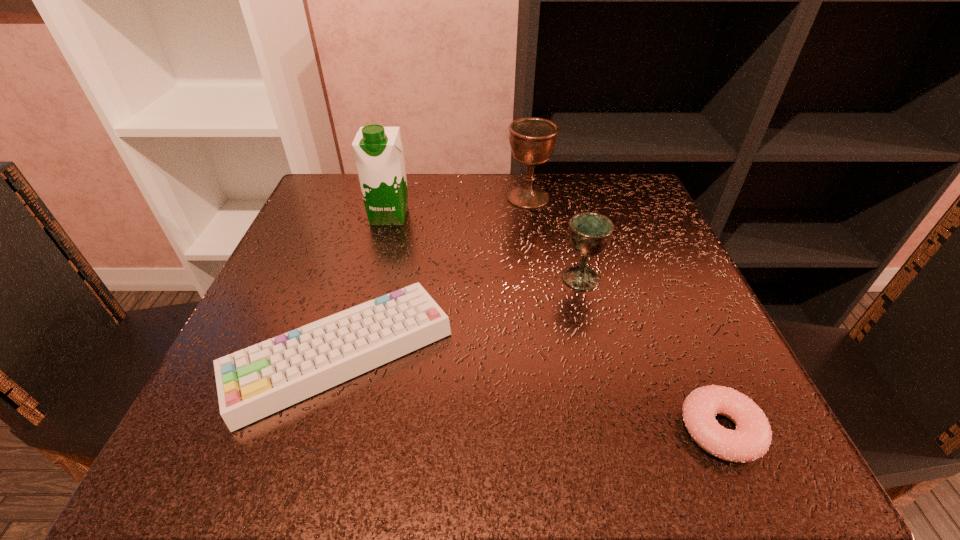
I want to click on doughnut that is at the right edge, so pyautogui.click(x=750, y=441).

You are a GUI agent. You are given a task and a screenshot of the screen. Output one action in this format:
    pyautogui.click(x=<x>, y=<y>)
    Task: Click on the object positioned at the far left corner
    This screenshot has width=960, height=540.
    Given the screenshot: What is the action you would take?
    pyautogui.click(x=378, y=150)

You are a GUI agent. You are given a task and a screenshot of the screen. Output one action in this format:
    pyautogui.click(x=<x>, y=<y>)
    Task: Click on the object that is at the near left corner
    The height and width of the screenshot is (540, 960).
    Given the screenshot: What is the action you would take?
    pyautogui.click(x=255, y=382)

Image resolution: width=960 pixels, height=540 pixels. I want to click on object located in the near right corner section of the desktop, so click(750, 441).

The height and width of the screenshot is (540, 960). Identify the location of free spot at the far edge of the desktop. click(x=520, y=220).

In the image, there is a desktop. At what (x,y) coordinates should I click in order to perform the action: click on vacant space at the near edge. Please return your answer as a coordinate pair (x, y). Image resolution: width=960 pixels, height=540 pixels. Looking at the image, I should click on (633, 463).

The width and height of the screenshot is (960, 540). I want to click on vacant space at the left edge, so click(x=303, y=315).

Where is `free space at the right edge`? The height and width of the screenshot is (540, 960). free space at the right edge is located at coordinates (615, 325).

Locate an element on the screen. The image size is (960, 540). free space at the far left corner of the desktop is located at coordinates (351, 195).

At what (x,y) coordinates should I click in order to perform the action: click on free space at the far right corner. Please return your answer as a coordinate pair (x, y). The image size is (960, 540). Looking at the image, I should click on (590, 204).